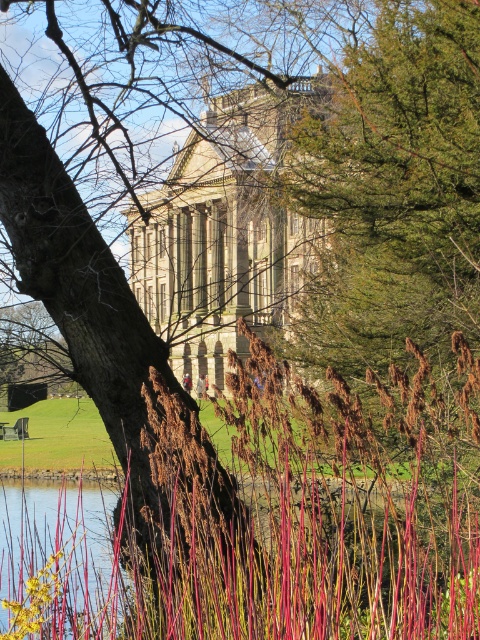
Question: Does reddish-brown grass at center lie behind clear water at lower left?

Choices:
 (A) no
 (B) yes

Answer: (A)

Question: Is reddish-brown grass at center smaller than clear water at lower left?

Choices:
 (A) no
 (B) yes

Answer: (A)

Question: Does reddish-brown grass at center have a lesser width compared to clear water at lower left?

Choices:
 (A) no
 (B) yes

Answer: (A)